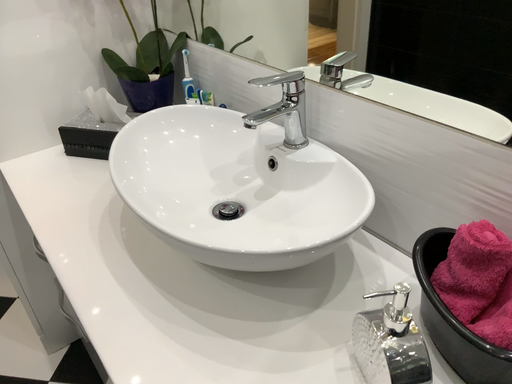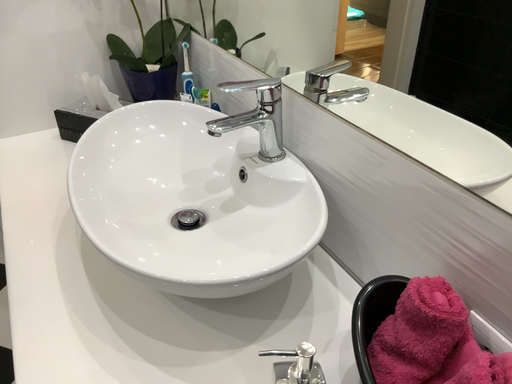
Question: Which way did the camera rotate in the video?

Choices:
 (A) rotated left
 (B) rotated right

Answer: (A)